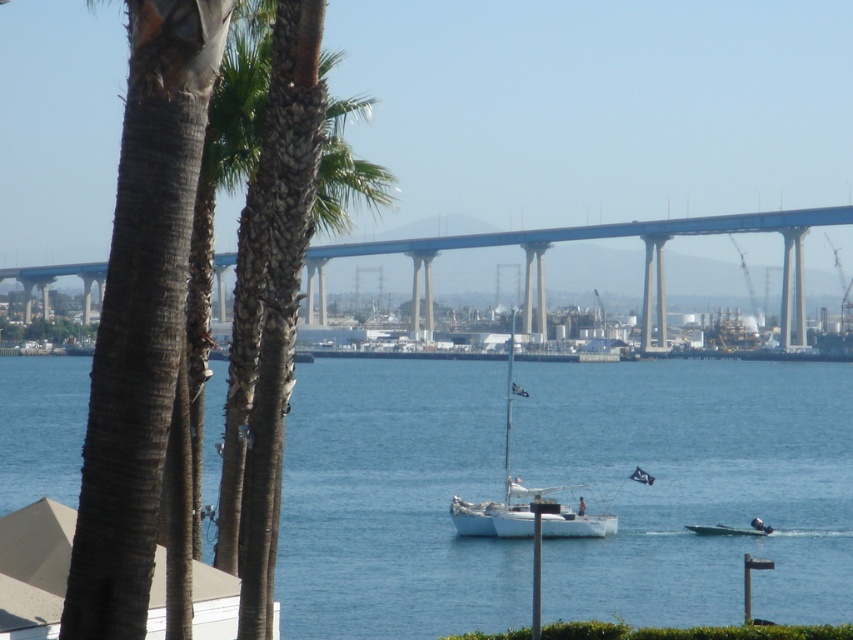
You are standing on the deck of the sailboat and want to navigate to the blue water at center. Based on the coordinates provided, in which direction should you steer the boat?

The blue water at center is located at coordinates point (x=694, y=486). Since the sailboat is in the middle ground, you should steer towards the coordinates to reach the blue water at center.

You are standing at the point labeled as point (694, 486) in the image. What is the closest object to you in the scene?

The closest object to you at point (694, 486) is the blue water at center.

You are a photographer standing on the shore of the coastal view scene. You want to take a photo that includes both the blue concrete bridge at center and the white matte sailboat at center. Which object will appear closer to the camera in the photo?

The blue concrete bridge at center will appear closer to the camera in the photo because it is positioned in front of the white matte sailboat at center according to the scene description.